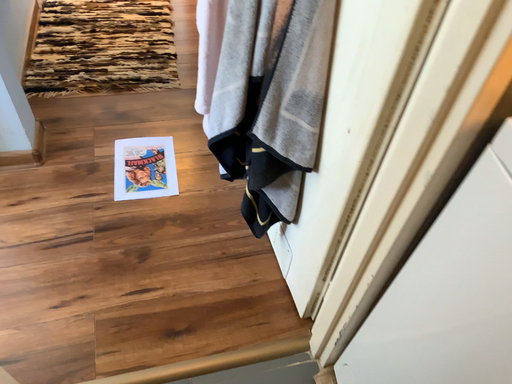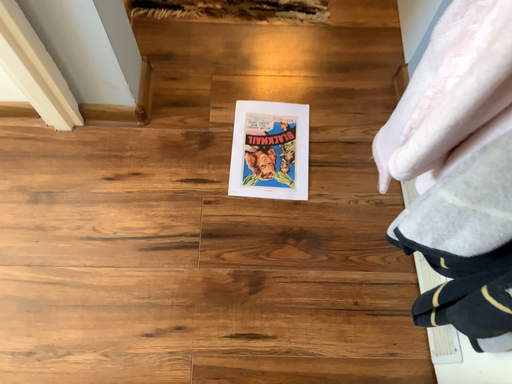
Question: Which way did the camera rotate in the video?

Choices:
 (A) rotated left
 (B) rotated right

Answer: (A)